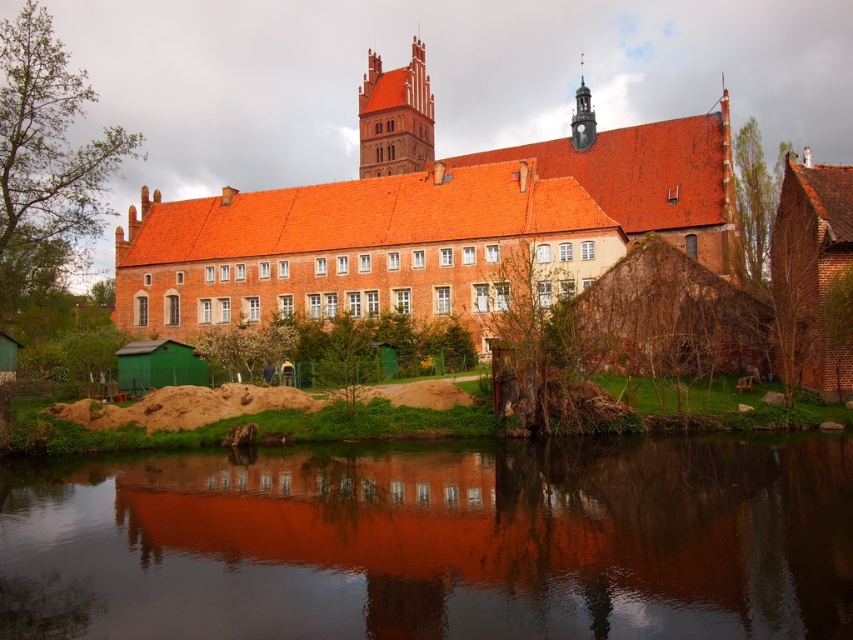
Which of these two, smooth water at center or reddish-brown brick church at center, stands shorter?

smooth water at center is shorter.

Find the location of a particular element. smooth water at center is located at coordinates (436, 541).

Does point (717, 259) come behind point (364, 163)?

No, it is not.

Who is taller, reddish-brown brick church at center or matte brick tower at upper center?

With more height is reddish-brown brick church at center.

Between point (396, 192) and point (372, 141), which one is positioned behind?

Point (372, 141)

Locate an element on the screen. reddish-brown brick church at center is located at coordinates (427, 220).

Does smooth water at center appear on the right side of matte brick tower at upper center?

Yes, smooth water at center is to the right of matte brick tower at upper center.

Looking at this image, who is higher up, smooth water at center or matte brick tower at upper center?

Positioned higher is matte brick tower at upper center.

You are a GUI agent. You are given a task and a screenshot of the screen. Output one action in this format:
    pyautogui.click(x=<x>, y=<y>)
    Task: Click on the smooth water at center
    
    Given the screenshot: What is the action you would take?
    pyautogui.click(x=436, y=541)